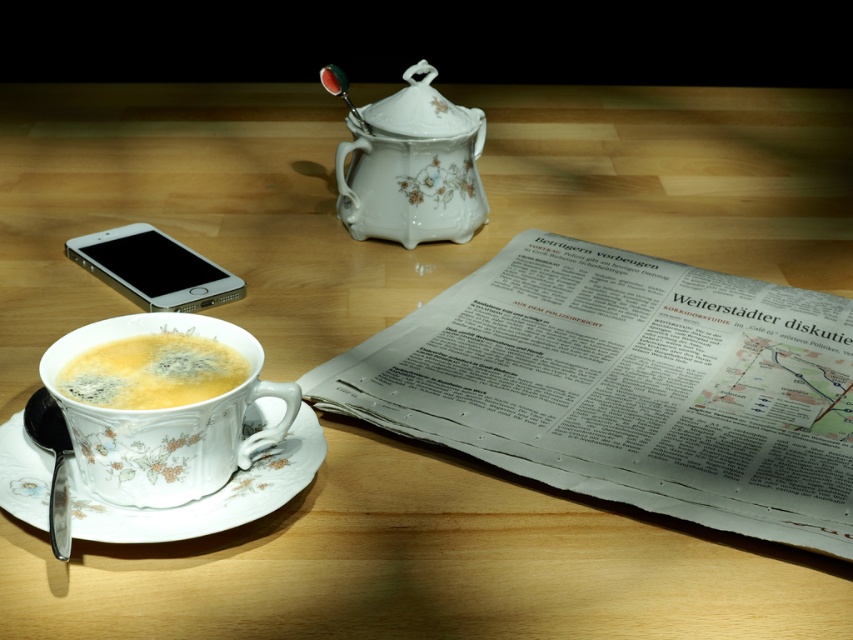
Is porcelain floral tea pot at center taller than silver metallic smartphone at lower left?

Yes.

Does porcelain floral tea pot at center have a lesser width compared to silver metallic smartphone at lower left?

Yes, porcelain floral tea pot at center is thinner than silver metallic smartphone at lower left.

Who is more distant from viewer, (x=462, y=179) or (x=229, y=292)?

Point (x=462, y=179)

Identify the location of porcelain floral tea pot at center. The image size is (853, 640). click(412, 166).

Which of these two, porcelain cup at lower left or matte porcelain cup of tea at lower left, stands taller?

porcelain cup at lower left

Is the position of porcelain cup at lower left less distant than that of matte porcelain cup of tea at lower left?

Yes.

Is point (103, 333) positioned before point (210, 364)?

No, it is not.

Find the location of `porcelain cup at lower left`. porcelain cup at lower left is located at coordinates (165, 419).

Can you confirm if porcelain floral tea pot at center is positioned below porcelain saucer at lower left?

Incorrect, porcelain floral tea pot at center is not positioned below porcelain saucer at lower left.

Find the location of a particular element. porcelain floral tea pot at center is located at coordinates (412, 166).

You are a GUI agent. You are given a task and a screenshot of the screen. Output one action in this format:
    pyautogui.click(x=<x>, y=<y>)
    Task: Click on the porcelain floral tea pot at center
    Image resolution: width=853 pixels, height=640 pixels.
    Given the screenshot: What is the action you would take?
    pyautogui.click(x=412, y=166)